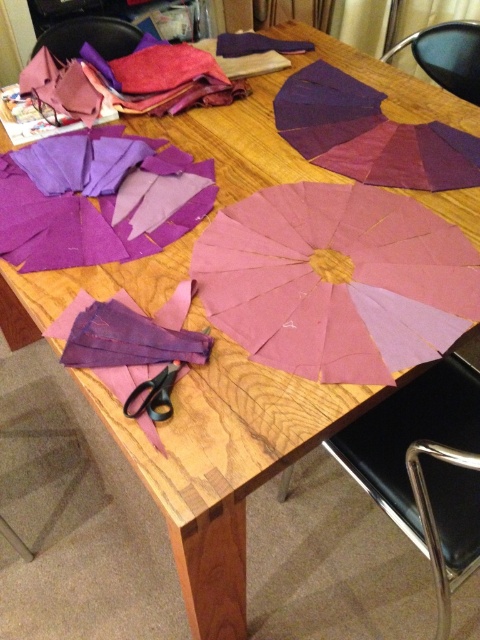
Who is positioned more to the right, purple paper umbrella at upper center or black plastic chair at upper right?

A: From the viewer's perspective, black plastic chair at upper right appears more on the right side.

Can you confirm if purple paper umbrella at upper center is smaller than black plastic chair at upper right?

Actually, purple paper umbrella at upper center might be larger than black plastic chair at upper right.

Between point (468, 186) and point (444, 24), which one is positioned behind?

The point (444, 24) is more distant.

Locate an element on the screen. The image size is (480, 640). purple paper umbrella at upper center is located at coordinates (370, 134).

Is black plastic chair at upper left thinner than black plastic scissors at lower left?

In fact, black plastic chair at upper left might be wider than black plastic scissors at lower left.

Which of these two, black plastic chair at upper left or black plastic scissors at lower left, stands shorter?

Standing shorter between the two is black plastic scissors at lower left.

Who is more distant from viewer, (95, 36) or (165, 381)?

The point (95, 36) is behind.

Where is `black plastic chair at upper left`? This screenshot has height=640, width=480. black plastic chair at upper left is located at coordinates (90, 36).

Is pink paper umbrella at center bigger than purple matte umbrella at center?

Correct, pink paper umbrella at center is larger in size than purple matte umbrella at center.

Is point (386, 280) positioned in front of point (455, 154)?

Yes, it is.

The image size is (480, 640). I want to click on pink paper umbrella at center, so click(336, 280).